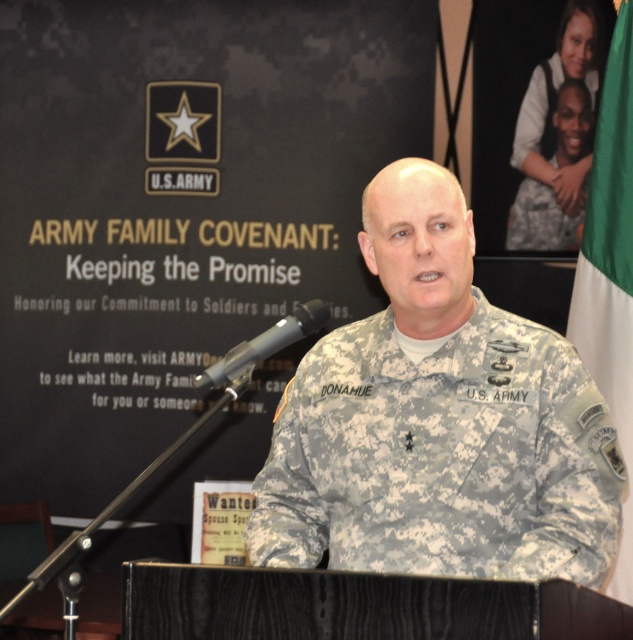
What is the relationship between the camouflage fabric uniform at center and the green fabric flag at right in terms of their positions?

The camouflage fabric uniform at center is positioned under the green fabric flag at right.

What is the exact coordinate of the camouflage fabric uniform at center?

The camouflage fabric uniform at center is positioned at point (442, 458).

You are a tailor observing two camouflage uniforms in the image. The first is the camouflage fabric uniform at center, and the second is the camouflage uniform at upper right. Which one has a shorter length?

The camouflage fabric uniform at center is shorter than the camouflage uniform at upper right.